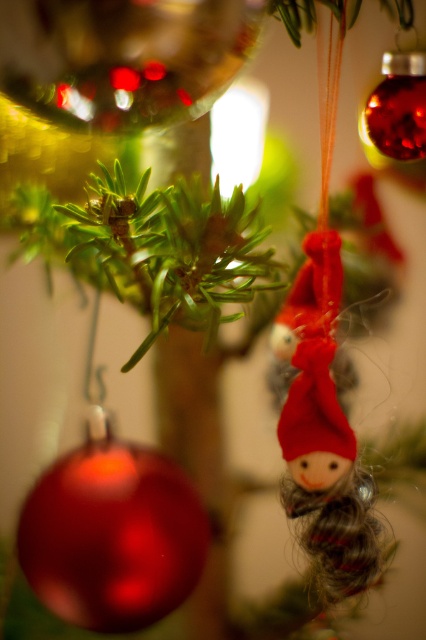
You are a child trying to place both the glossy red bauble at center and the matte red fabric doll at center into a small gift box. Which ornament will you have to place first to ensure it fits?

The glossy red bauble at center occupies less space than the matte red fabric doll at center, so you should place the glossy red bauble at center first to ensure the larger matte red fabric doll at center can fit afterward.

You are a curious child who just found the glossy red bauble at center and the matte red fabric doll at center on the Christmas tree. Which ornament is closer to you?

The matte red fabric doll at center is closer to you because it is above the glossy red bauble at center, which is below it.